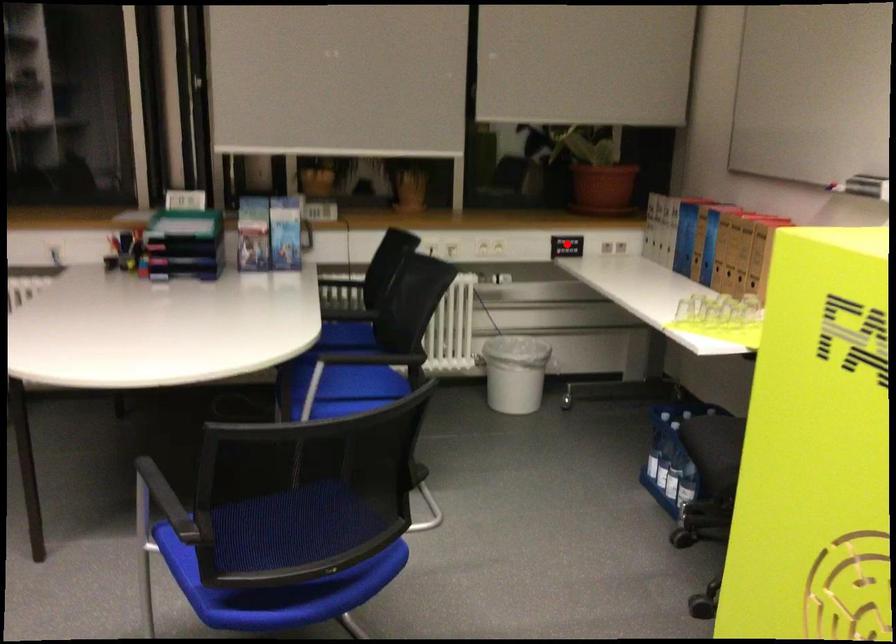
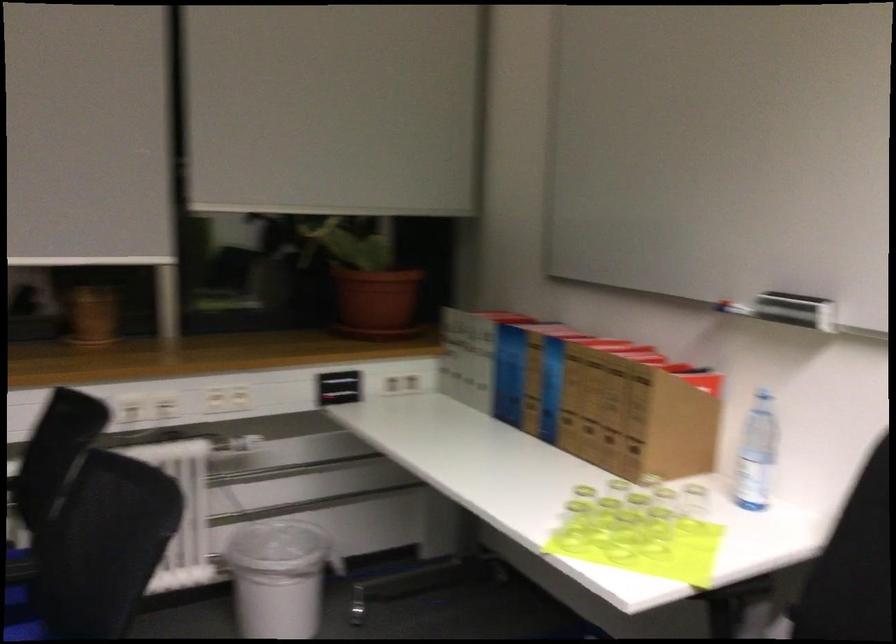
Where in the second image is the point corresponding to the highlighted location from the first image?

(339, 386)